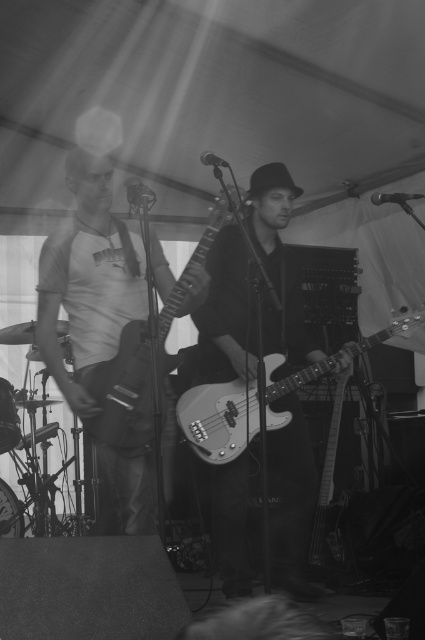
How distant is matte white t-shirt at left from metallic silver bass guitar at center?

matte white t-shirt at left and metallic silver bass guitar at center are 21.89 inches apart from each other.

Does matte white t-shirt at left have a larger size compared to metallic silver bass guitar at center?

Incorrect, matte white t-shirt at left is not larger than metallic silver bass guitar at center.

What do you see at coordinates (88, 284) in the screenshot?
I see `matte white t-shirt at left` at bounding box center [88, 284].

Identify the location of matte white t-shirt at left. (88, 284).

Between metallic bass guitar at center and matte white t-shirt at left, which one appears on the left side from the viewer's perspective?

matte white t-shirt at left

Does metallic bass guitar at center have a larger size compared to matte white t-shirt at left?

Yes.

Is point (223, 545) positioned after point (40, 288)?

Yes.

At what (x,y) coordinates should I click in order to perform the action: click on metallic bass guitar at center. Please return your answer as a coordinate pair (x, y). Looking at the image, I should click on (252, 289).

Can you confirm if metallic bass guitar at center is positioned to the left of matte black bass at center?

Incorrect, metallic bass guitar at center is not on the left side of matte black bass at center.

In the scene shown: Is metallic bass guitar at center wider than matte black bass at center?

Yes, metallic bass guitar at center is wider than matte black bass at center.

Which is in front, point (297, 332) or point (142, 387)?

Positioned in front is point (142, 387).

Identify the location of metallic bass guitar at center. (252, 289).